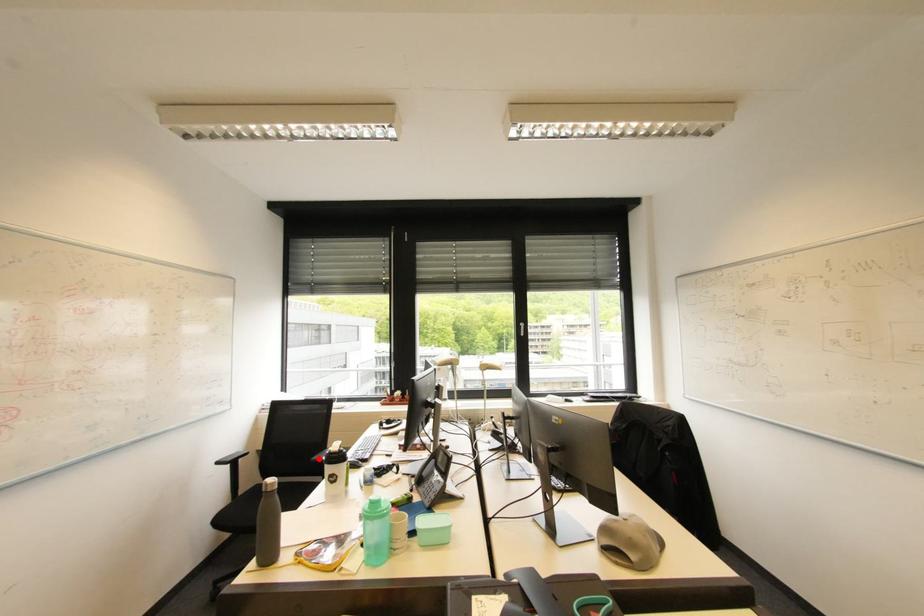
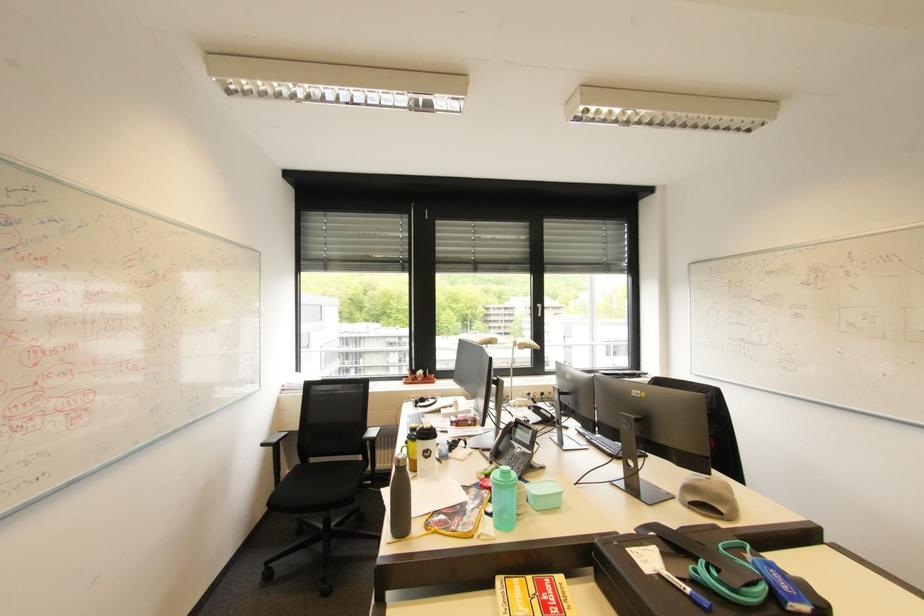
Question: I am providing you with two images of the same scene from different viewpoints. Given a red point in image1, look at the same physical point in image2. Is it:

Choices:
 (A) Closer to the viewpoint
 (B) Farther from the viewpoint

Answer: (A)